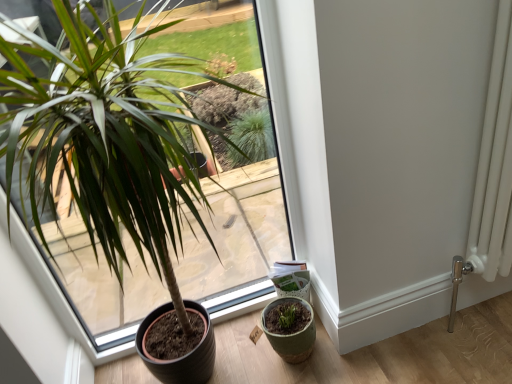
What are the coordinates of `free location to the right of green matte flowerpot at lower right` in the screenshot? It's located at (356, 356).